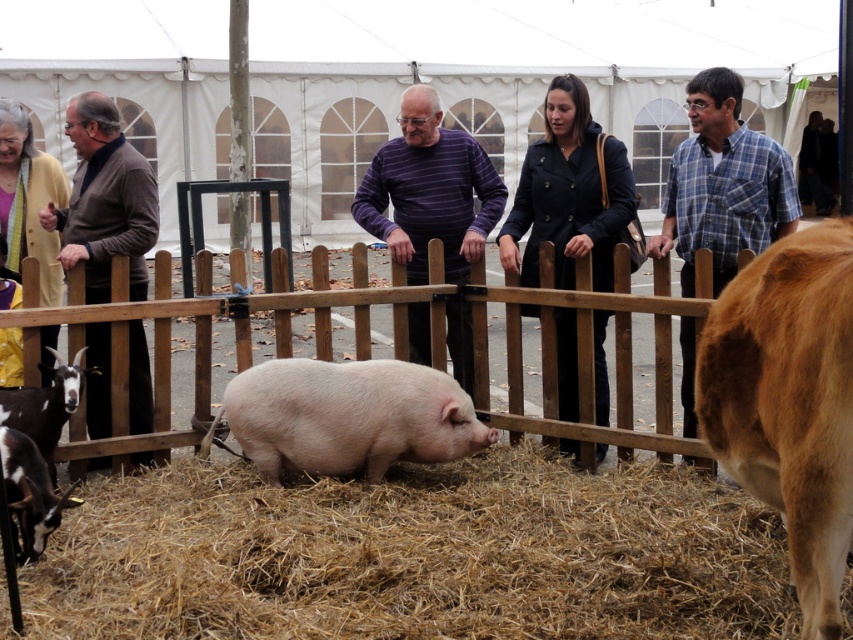
Question: Which object appears farthest from the camera in this image?

Choices:
 (A) light pink matte pig at lower left
 (B) purple striped sweater at center
 (C) dark blue coat at center

Answer: (B)

Question: Can you confirm if wooden fence at center is thinner than brown woolen sweater at left?

Choices:
 (A) yes
 (B) no

Answer: (B)

Question: Does brown straw at center appear under brown woolen sweater at left?

Choices:
 (A) no
 (B) yes

Answer: (B)

Question: Does wooden fence at center appear under purple striped sweater at center?

Choices:
 (A) no
 (B) yes

Answer: (B)

Question: Which of the following is the farthest from the observer?

Choices:
 (A) (32, 400)
 (B) (679, 189)
 (C) (830, 579)
 (D) (554, 198)

Answer: (B)

Question: Based on their relative distances, which object is farther from the pink matte pig at center?

Choices:
 (A) brown woolen sweater at left
 (B) brown straw at center

Answer: (A)